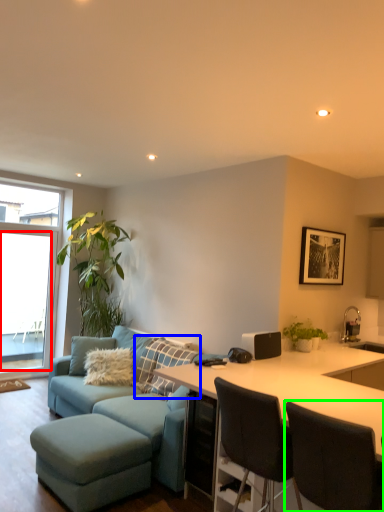
Question: Which object is the farthest from window screen (highlighted by a red box)? Choose among these: pillow (highlighted by a blue box) or chair (highlighted by a green box).

Choices:
 (A) pillow
 (B) chair

Answer: (B)